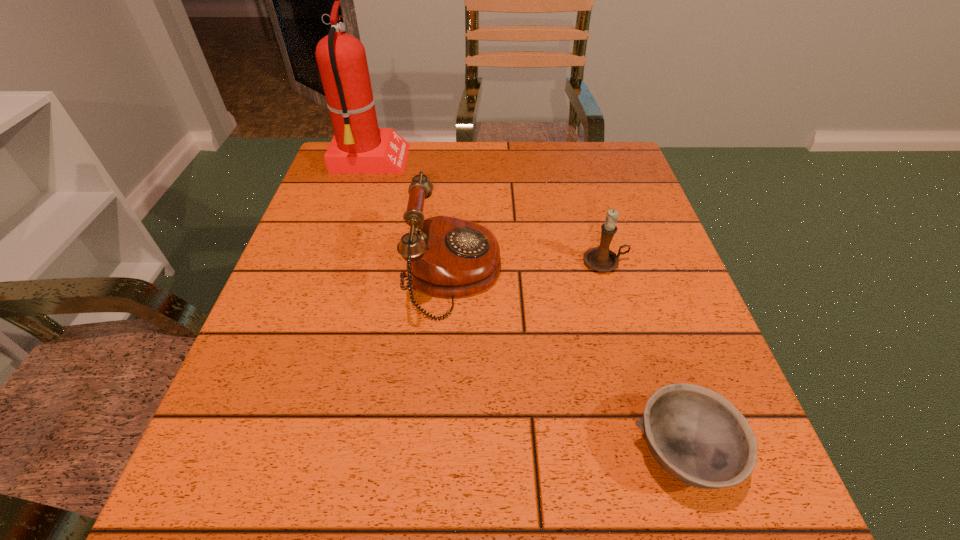
Where is `the leftmost object`? The image size is (960, 540). the leftmost object is located at coordinates (358, 146).

In order to click on fire extinguisher in this screenshot , I will do `click(358, 146)`.

What are the coordinates of `the third object from right to left` in the screenshot? It's located at (449, 257).

Find the location of `the second tallest object`. the second tallest object is located at coordinates (449, 257).

Locate an element on the screen. candle holder is located at coordinates (601, 259).

Where is `the nearest object`? The height and width of the screenshot is (540, 960). the nearest object is located at coordinates (699, 437).

In order to click on bowl in this screenshot , I will do 699,437.

The image size is (960, 540). I want to click on free space located 0.100m on the front-facing side of the fire extinguisher, so click(444, 161).

The height and width of the screenshot is (540, 960). What are the coordinates of `free point located on the dial of the telephone` in the screenshot? It's located at (589, 274).

The image size is (960, 540). I want to click on free space located on the side of the second shortest object with the handle, so click(x=675, y=262).